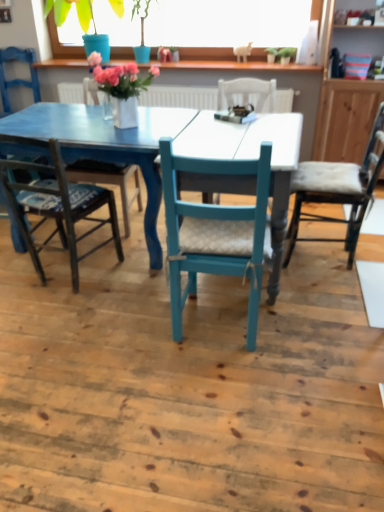
Identify the location of matte blue chair at left, the 2th chair when ordered from left to right. (17, 79).

Image resolution: width=384 pixels, height=512 pixels. I want to click on teal wood chair at center, placed as the fifth chair when sorted from left to right, so click(216, 233).

This screenshot has width=384, height=512. What do you see at coordinates (337, 190) in the screenshot? I see `white cushioned chair at right, the first chair in the right-to-left sequence` at bounding box center [337, 190].

Measure the distance between point (353,236) and camera.

The depth of point (353,236) is 2.50 meters.

What is the approximate width of matte blue chair at left, the first chair when ordered from left to right?

matte blue chair at left, the first chair when ordered from left to right, is 19.34 inches wide.

Where is `matte blue chair at left, the first chair when ordered from left to right`? The height and width of the screenshot is (512, 384). matte blue chair at left, the first chair when ordered from left to right is located at coordinates (17, 79).

Identify the location of matte blue pot at upper center. The height and width of the screenshot is (512, 384). (63, 22).

Locate an element on the screen. The image size is (384, 512). matte blue chair at left, the fifth chair positioned from the right is located at coordinates (17, 79).

Does point (5, 79) appear closer or farther from the camera than point (123, 209)?

Clearly, point (5, 79) is more distant from the camera than point (123, 209).

From a real-world perspective, which object stands above the other?

In real-world perspective, matte blue chair at left, the first chair when ordered from left to right, is above.

Is matte blue chair at left, the first chair when ordered from left to right, turned away from matte blue chair at center, positioned as the 4th chair in left-to-right order?

That's not correct — matte blue chair at left, the first chair when ordered from left to right, is not looking away from matte blue chair at center, positioned as the 4th chair in left-to-right order.

In the image, is matte blue chair at left, which is the sixth chair from right to left, positioned in front of or behind matte blue chair at center, which ranks as the 3th chair in right-to-left order?

In the image, matte blue chair at left, which is the sixth chair from right to left, appears behind matte blue chair at center, which ranks as the 3th chair in right-to-left order.

Are matte blue chair at left, the 2th chair when ordered from left to right, and matte blue chair at center, the 4th chair when ordered from right to left, located far from each other?

matte blue chair at left, the 2th chair when ordered from left to right, is far away from matte blue chair at center, the 4th chair when ordered from right to left.

Relative to matte blue chair at center, positioned as the 3th chair in left-to-right order, is matte blue chair at left, the fifth chair positioned from the right, in front or behind?

In the image, matte blue chair at left, the fifth chair positioned from the right, appears behind matte blue chair at center, positioned as the 3th chair in left-to-right order.

Is matte blue chair at left, the 2th chair when ordered from left to right, positioned beyond the bounds of matte blue chair at center, the 4th chair when ordered from right to left?

matte blue chair at left, the 2th chair when ordered from left to right, lies outside matte blue chair at center, the 4th chair when ordered from right to left,'s area.

Is matte blue chair at left, the 2th chair when ordered from left to right, to the right of matte blue chair at center, the 4th chair when ordered from right to left, from the viewer's perspective?

In fact, matte blue chair at left, the 2th chair when ordered from left to right, is to the left of matte blue chair at center, the 4th chair when ordered from right to left.

Considering the sizes of objects teal wood chair at center, which appears as the 2th chair when viewed from the right, and matte blue chair at left, the fifth chair positioned from the right, in the image provided, who is bigger, teal wood chair at center, which appears as the 2th chair when viewed from the right, or matte blue chair at left, the fifth chair positioned from the right,?

matte blue chair at left, the fifth chair positioned from the right.

Consider the image. Considering the positions of objects teal wood chair at center, placed as the fifth chair when sorted from left to right, and matte blue chair at left, the fifth chair positioned from the right, in the image provided, who is behind, teal wood chair at center, placed as the fifth chair when sorted from left to right, or matte blue chair at left, the fifth chair positioned from the right,?

matte blue chair at left, the fifth chair positioned from the right, is further from the camera.

Does point (171, 298) lie behind point (16, 241)?

No, (171, 298) is in front of (16, 241).

Is teal wood chair at center, placed as the fifth chair when sorted from left to right, beside matte blue chair at left, the 2th chair when ordered from left to right?

No, teal wood chair at center, placed as the fifth chair when sorted from left to right, is not in contact with matte blue chair at left, the 2th chair when ordered from left to right.

Is matte blue chair at center, which ranks as the 3th chair in right-to-left order, at the back of matte blue chair at center, positioned as the 3th chair in left-to-right order?

That's not correct — matte blue chair at center, positioned as the 3th chair in left-to-right order, is not looking away from matte blue chair at center, which ranks as the 3th chair in right-to-left order.

Is matte blue chair at center, positioned as the 3th chair in left-to-right order, bigger than matte blue chair at center, positioned as the 4th chair in left-to-right order?

No, matte blue chair at center, positioned as the 3th chair in left-to-right order, is not bigger than matte blue chair at center, positioned as the 4th chair in left-to-right order.

Is matte blue chair at center, positioned as the 3th chair in left-to-right order, positioned beyond the bounds of matte blue chair at center, positioned as the 4th chair in left-to-right order?

matte blue chair at center, positioned as the 3th chair in left-to-right order, is positioned outside matte blue chair at center, positioned as the 4th chair in left-to-right order.

Does point (24, 142) come behind point (68, 170)?

No, it is in front of (68, 170).

Where is `chair that is the 2nd one when counting rightward from the matte blue chair at left, the fifth chair positioned from the right`? The height and width of the screenshot is (512, 384). chair that is the 2nd one when counting rightward from the matte blue chair at left, the fifth chair positioned from the right is located at coordinates (108, 181).

How many degrees apart are the facing directions of matte blue chair at left, the fifth chair positioned from the right, and matte blue chair at center, positioned as the 4th chair in left-to-right order?

The facing directions of matte blue chair at left, the fifth chair positioned from the right, and matte blue chair at center, positioned as the 4th chair in left-to-right order, are 22.4 degrees apart.

Between matte blue chair at left, the fifth chair positioned from the right, and matte blue chair at center, positioned as the 4th chair in left-to-right order, which one has less height?

matte blue chair at center, positioned as the 4th chair in left-to-right order.

Is matte blue chair at left, the fifth chair positioned from the right, wider or thinner than matte blue chair at left, the first chair when ordered from left to right?

matte blue chair at left, the fifth chair positioned from the right, is wider than matte blue chair at left, the first chair when ordered from left to right.

Is point (30, 58) closer to viewer compared to point (7, 97)?

Yes, it is.

Who is bigger, matte blue chair at left, the 2th chair when ordered from left to right, or matte blue chair at left, which is the sixth chair from right to left?

With larger size is matte blue chair at left, the 2th chair when ordered from left to right.

Is matte blue chair at left, the fifth chair positioned from the right, taller or shorter than matte blue chair at left, which is the sixth chair from right to left?

Clearly, matte blue chair at left, the fifth chair positioned from the right, is taller compared to matte blue chair at left, which is the sixth chair from right to left.

Is white cushioned chair at right, which is the 6th chair in left-to-right order, touching matte blue chair at center, which ranks as the 3th chair in right-to-left order?

No, white cushioned chair at right, which is the 6th chair in left-to-right order, is not in contact with matte blue chair at center, which ranks as the 3th chair in right-to-left order.

Is white cushioned chair at right, the first chair in the right-to-left sequence, facing away from matte blue chair at center, positioned as the 4th chair in left-to-right order?

No, matte blue chair at center, positioned as the 4th chair in left-to-right order, is not at the back of white cushioned chair at right, the first chair in the right-to-left sequence.

The image size is (384, 512). I want to click on chair that appears below the matte blue chair at center, which ranks as the 3th chair in right-to-left order (from a real-world perspective), so click(x=337, y=190).

This screenshot has width=384, height=512. In order to click on the 2nd chair below the matte blue chair at left, which is the sixth chair from right to left (from the image's perspective) in this screenshot , I will do `click(108, 181)`.

In order to click on the 2nd chair located above the matte blue chair at center, the 4th chair when ordered from right to left (from a real-world perspective) in this screenshot , I will do `click(17, 79)`.

Looking at the image, which one is located closer to matte blue chair at left, the fifth chair positioned from the right, matte blue chair at left, the first chair when ordered from left to right, or teal wood chair at center, which appears as the 2th chair when viewed from the right?

Among the two, matte blue chair at left, the first chair when ordered from left to right, is located nearer to matte blue chair at left, the fifth chair positioned from the right.

From the picture: Which object lies further to the anchor point white cushioned chair at right, the first chair in the right-to-left sequence, matte blue chair at left, which is the sixth chair from right to left, or teal wood chair at center, placed as the fifth chair when sorted from left to right?

matte blue chair at left, which is the sixth chair from right to left, is positioned further to the anchor white cushioned chair at right, the first chair in the right-to-left sequence.

Looking at the image, which one is located further to matte blue chair at center, positioned as the 4th chair in left-to-right order, matte blue chair at center, the 4th chair when ordered from right to left, or matte blue pot at upper center?

The object further to matte blue chair at center, positioned as the 4th chair in left-to-right order, is matte blue pot at upper center.

Looking at this image, from the image, which object appears to be farther from matte blue pot at upper center, matte blue chair at left, which is the sixth chair from right to left, or matte blue chair at center, the 4th chair when ordered from right to left?

matte blue chair at center, the 4th chair when ordered from right to left, lies further to matte blue pot at upper center than the other object.

Estimate the real-world distances between objects in this image. Which object is closer to matte blue chair at left, the fifth chair positioned from the right, matte blue chair at center, the 4th chair when ordered from right to left, or white cushioned chair at right, which is the 6th chair in left-to-right order?

Based on the image, matte blue chair at center, the 4th chair when ordered from right to left, appears to be nearer to matte blue chair at left, the fifth chair positioned from the right.

Which object lies further to the anchor point matte blue pot at upper center, matte blue chair at center, positioned as the 3th chair in left-to-right order, or teal wood chair at center, which appears as the 2th chair when viewed from the right?

Among the two, teal wood chair at center, which appears as the 2th chair when viewed from the right, is located further to matte blue pot at upper center.

From the picture: Considering their positions, is matte blue chair at left, which is the sixth chair from right to left, positioned further to matte blue chair at center, which ranks as the 3th chair in right-to-left order, than matte blue pot at upper center?

matte blue chair at left, which is the sixth chair from right to left.

Based on their spatial positions, is teal wood chair at center, placed as the fifth chair when sorted from left to right, or white cushioned chair at right, the first chair in the right-to-left sequence, closer to matte blue pot at upper center?

Based on the image, white cushioned chair at right, the first chair in the right-to-left sequence, appears to be nearer to matte blue pot at upper center.

I want to click on houseplant situated between matte blue chair at left, the fifth chair positioned from the right, and white cushioned chair at right, the first chair in the right-to-left sequence, from left to right, so click(x=63, y=22).

Locate an element on the screen. This screenshot has height=512, width=384. houseplant positioned between matte blue chair at center, positioned as the 3th chair in left-to-right order, and matte blue chair at left, the first chair when ordered from left to right, from near to far is located at coordinates (63, 22).

You are a GUI agent. You are given a task and a screenshot of the screen. Output one action in this format:
    pyautogui.click(x=<x>, y=<y>)
    Task: Click on the chair between matte blue chair at center, positioned as the 4th chair in left-to-right order, and white cushioned chair at right, which is the 6th chair in left-to-right order, in the horizontal direction
    The height and width of the screenshot is (512, 384).
    Given the screenshot: What is the action you would take?
    pyautogui.click(x=216, y=233)

Where is `houseplant situated between matte blue chair at left, which is the sixth chair from right to left, and white cushioned chair at right, the first chair in the right-to-left sequence, from left to right`? houseplant situated between matte blue chair at left, which is the sixth chair from right to left, and white cushioned chair at right, the first chair in the right-to-left sequence, from left to right is located at coordinates (63, 22).